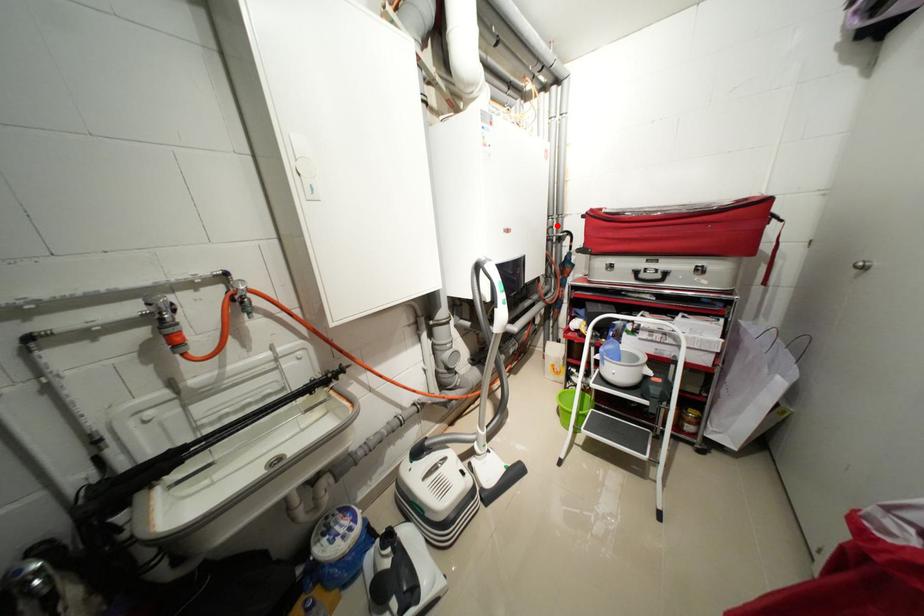
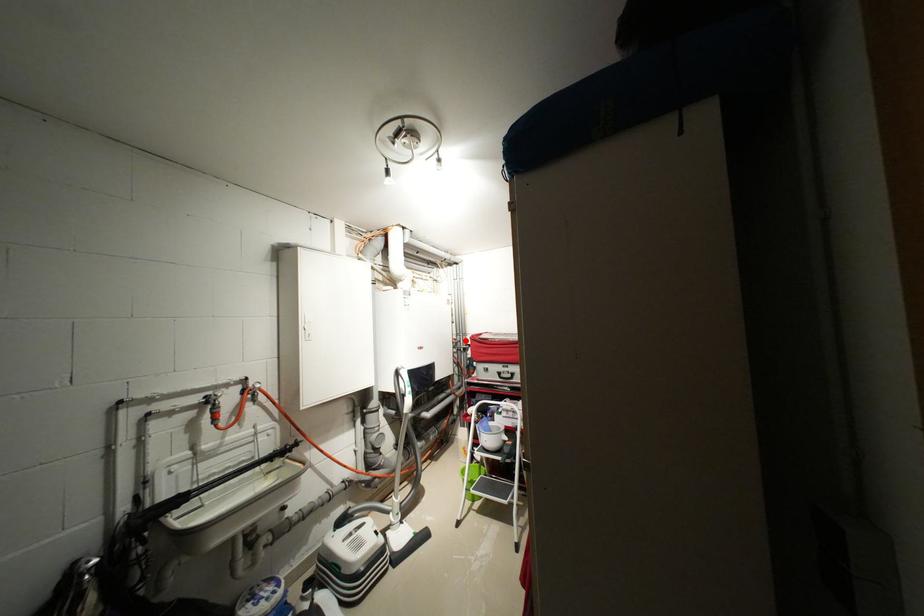
I am providing you with two images of the same scene from different viewpoints. A red point is marked on the first image and another point is marked on the second image. Does the point marked in image1 correspond to the same location as the one in image2?

Yes